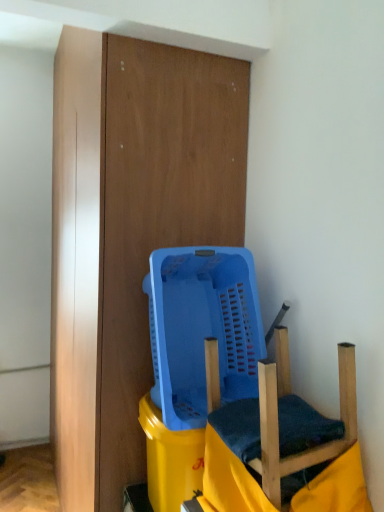
Locate an element on the screen. The height and width of the screenshot is (512, 384). blue plastic basket at center is located at coordinates (235, 366).

In the scene shown: What is the approximate width of blue plastic basket at center?

The width of blue plastic basket at center is 24.27 inches.

What do you see at coordinates (235, 366) in the screenshot? I see `blue plastic basket at center` at bounding box center [235, 366].

Find the location of a particular element. The width and height of the screenshot is (384, 512). wooden swivel chair at lower right is located at coordinates (278, 421).

The image size is (384, 512). What do you see at coordinates (278, 421) in the screenshot? I see `wooden swivel chair at lower right` at bounding box center [278, 421].

Locate an element on the screen. This screenshot has width=384, height=512. blue plastic basket at center is located at coordinates (235, 366).

Which object is positioned more to the left, wooden swivel chair at lower right or blue plastic basket at center?

blue plastic basket at center is more to the left.

Is wooden swivel chair at lower right further to the viewer compared to blue plastic basket at center?

No, wooden swivel chair at lower right is closer to the viewer.

Which is farther, (266, 466) or (260, 378)?

The point (266, 466) is farther from the camera.

From the image's perspective, would you say wooden swivel chair at lower right is positioned over blue plastic basket at center?

No.

From a real-world perspective, relative to blue plastic basket at center, is wooden swivel chair at lower right vertically above or below?

Clearly, from a real-world perspective, wooden swivel chair at lower right is below blue plastic basket at center.

Considering the sizes of wooden swivel chair at lower right and blue plastic basket at center in the image, is wooden swivel chair at lower right wider or thinner than blue plastic basket at center?

In the image, wooden swivel chair at lower right appears to be more narrow than blue plastic basket at center.

From their relative heights in the image, would you say wooden swivel chair at lower right is taller or shorter than blue plastic basket at center?

wooden swivel chair at lower right is shorter than blue plastic basket at center.

Between wooden swivel chair at lower right and blue plastic basket at center, which one has larger size?

Bigger between the two is blue plastic basket at center.

Would you say wooden swivel chair at lower right is outside blue plastic basket at center?

Yes, wooden swivel chair at lower right is outside of blue plastic basket at center.

Is wooden swivel chair at lower right placed right next to blue plastic basket at center?

No, wooden swivel chair at lower right is not next to blue plastic basket at center.

Is wooden swivel chair at lower right turned away from blue plastic basket at center?

wooden swivel chair at lower right is not turned away from blue plastic basket at center.

What's the angular difference between wooden swivel chair at lower right and blue plastic basket at center's facing directions?

0.438 degrees.

Where is `furniture to the left of wooden swivel chair at lower right`? This screenshot has height=512, width=384. furniture to the left of wooden swivel chair at lower right is located at coordinates (235, 366).

Between blue plastic basket at center and wooden swivel chair at lower right, which one appears on the right side from the viewer's perspective?

Positioned to the right is wooden swivel chair at lower right.

Which object is closer to the camera, blue plastic basket at center or wooden swivel chair at lower right?

wooden swivel chair at lower right is closer to the camera.

Is point (224, 274) farther from viewer compared to point (346, 448)?

Yes.

From the image's perspective, between blue plastic basket at center and wooden swivel chair at lower right, who is located below?

wooden swivel chair at lower right.

From a real-world perspective, which is physically below, blue plastic basket at center or wooden swivel chair at lower right?

In real-world perspective, wooden swivel chair at lower right is lower.

Considering the relative sizes of blue plastic basket at center and wooden swivel chair at lower right in the image provided, is blue plastic basket at center wider than wooden swivel chair at lower right?

Yes, blue plastic basket at center is wider than wooden swivel chair at lower right.

Between blue plastic basket at center and wooden swivel chair at lower right, which one has more height?

blue plastic basket at center.

Can you confirm if blue plastic basket at center is bigger than wooden swivel chair at lower right?

Yes, blue plastic basket at center is bigger than wooden swivel chair at lower right.

Is blue plastic basket at center positioned beyond the bounds of wooden swivel chair at lower right?

Absolutely, blue plastic basket at center is external to wooden swivel chair at lower right.

Is blue plastic basket at center positioned far away from wooden swivel chair at lower right?

No, blue plastic basket at center is not far away from wooden swivel chair at lower right.

Is blue plastic basket at center aimed at wooden swivel chair at lower right?

No, blue plastic basket at center is not turned towards wooden swivel chair at lower right.

Can you tell me how much blue plastic basket at center and wooden swivel chair at lower right differ in facing direction?

The angle between the facing direction of blue plastic basket at center and the facing direction of wooden swivel chair at lower right is 0.438 degrees.

Where is `furniture that is above the wooden swivel chair at lower right (from the image's perspective)`? The image size is (384, 512). furniture that is above the wooden swivel chair at lower right (from the image's perspective) is located at coordinates (235, 366).

Where is `swivel chair that appears on the right of blue plastic basket at center`? Image resolution: width=384 pixels, height=512 pixels. swivel chair that appears on the right of blue plastic basket at center is located at coordinates (278, 421).

Locate an element on the screen. The image size is (384, 512). furniture that appears on the left of wooden swivel chair at lower right is located at coordinates (235, 366).